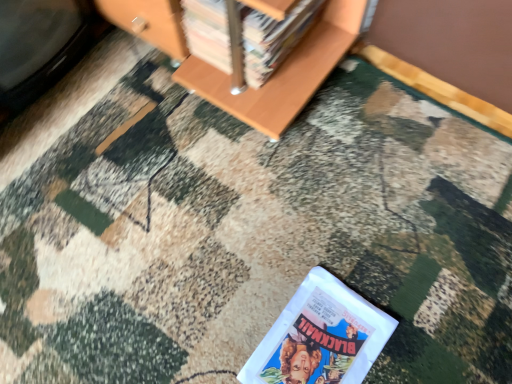
At what (x,y) coordinates should I click in order to perform the action: click on vacant space to the right of white glossy book at lower center, the 2th book in the top-to-bottom sequence. Please return your answer as a coordinate pair (x, y). This screenshot has height=384, width=512. Looking at the image, I should click on coord(423,322).